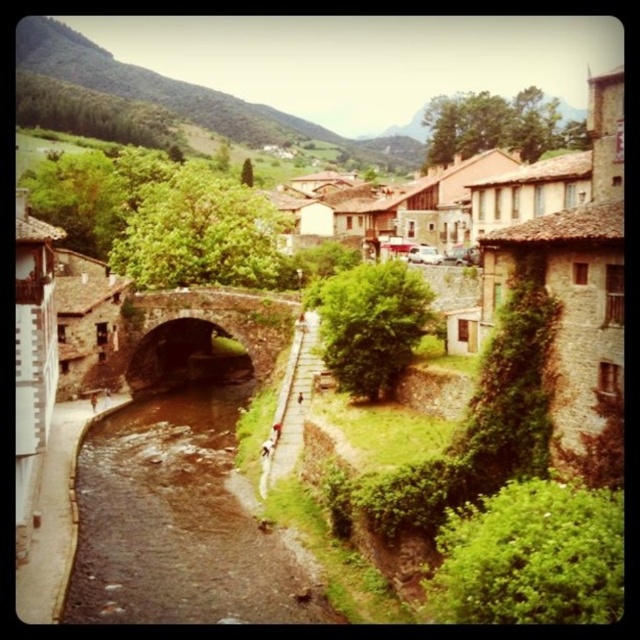
From the picture: Between brown smooth river at center and dark brown stone bridge at center, which one appears on the right side from the viewer's perspective?

brown smooth river at center

Can you confirm if brown smooth river at center is shorter than dark brown stone bridge at center?

Correct, brown smooth river at center is not as tall as dark brown stone bridge at center.

Who is more forward, [218,560] or [236,339]?

Positioned in front is point [218,560].

Identify the location of brown smooth river at center. (177, 522).